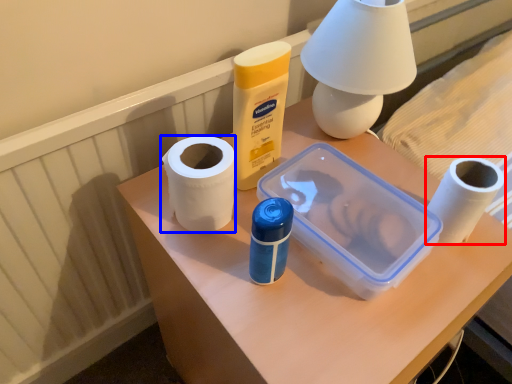
Question: Among these objects, which one is nearest to the camera, toilet paper (highlighted by a red box) or paper towel (highlighted by a blue box)?

Choices:
 (A) toilet paper
 (B) paper towel

Answer: (B)